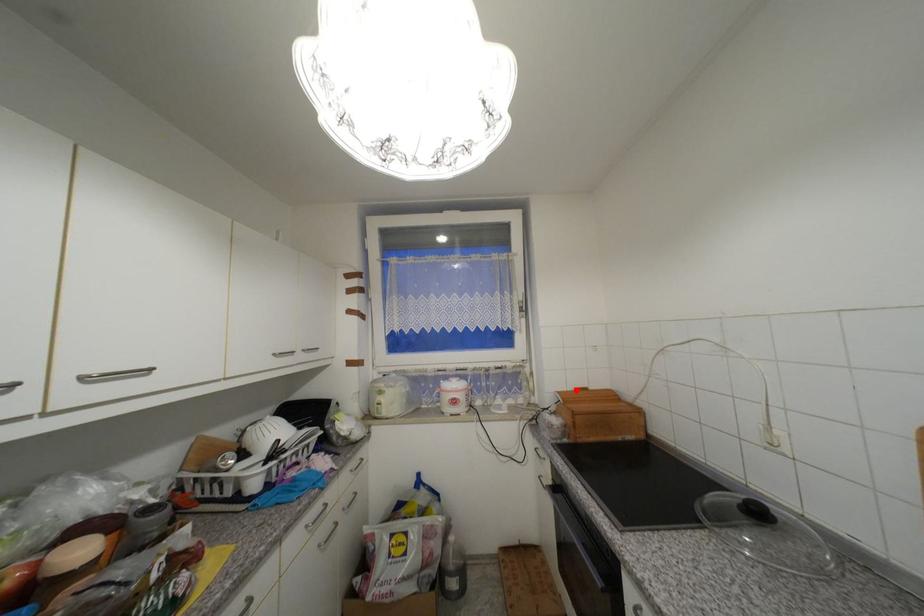
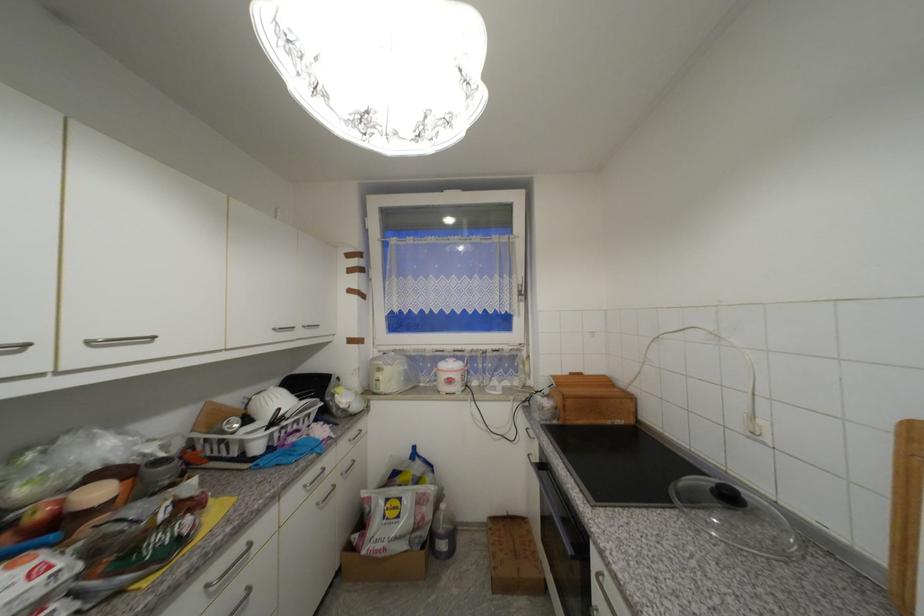
Question: I am providing you with two images of the same scene from different viewpoints. A red point is marked on the first image. Can you still see the location of the red point in image 2?

Choices:
 (A) Yes
 (B) No

Answer: (A)